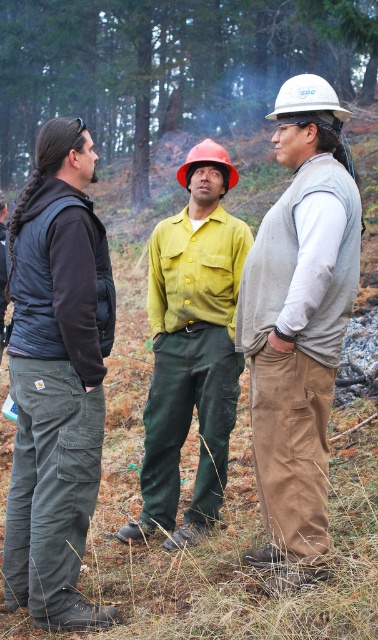
Question: Which point is farther to the camera?

Choices:
 (A) dark gray carhartt pants at left
 (B) gray fabric vest at center
 (C) matte yellow shirt at center
 (D) white hard hat at center

Answer: (C)

Question: Does dark gray carhartt pants at left have a smaller size compared to white hard hat at center?

Choices:
 (A) no
 (B) yes

Answer: (B)

Question: Which of these objects is positioned closest to the dark gray carhartt pants at left?

Choices:
 (A) matte yellow shirt at center
 (B) white hard hat at center

Answer: (A)

Question: Is green leafy tree at upper center below dark gray carhartt pants at left?

Choices:
 (A) yes
 (B) no

Answer: (B)

Question: Is gray fabric vest at center above white hard hat at center?

Choices:
 (A) yes
 (B) no

Answer: (B)

Question: Which point is farther from the camera taking this photo?

Choices:
 (A) (195, 145)
 (B) (339, 32)
 (C) (308, 276)

Answer: (B)